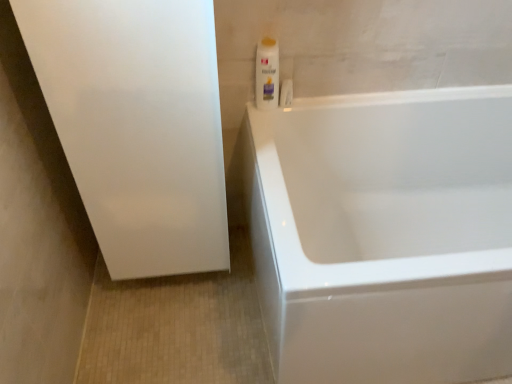
Question: In terms of size, does white plastic bottle at upper right appear bigger or smaller than white glossy bathtub at right?

Choices:
 (A) small
 (B) big

Answer: (A)

Question: In the image, is white plastic bottle at upper right on the left side or the right side of white glossy bathtub at right?

Choices:
 (A) right
 (B) left

Answer: (B)

Question: Based on their relative distances, which object is nearer to the white glossy bathtub at right?

Choices:
 (A) white plastic bottle at upper right
 (B) white matte screen door at left

Answer: (B)

Question: Which of these objects is positioned farthest from the white matte screen door at left?

Choices:
 (A) white plastic bottle at upper right
 (B) white glossy bathtub at right

Answer: (B)